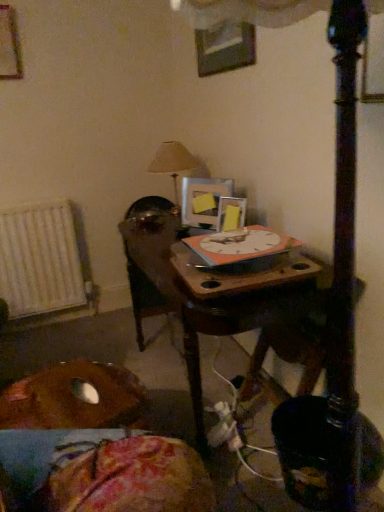
Question: Based on their sizes in the image, would you say matte silver picture frame at center, arranged as the fourth picture frame when viewed from the left, is bigger or smaller than yellow matte picture frame at upper center, which appears as the third picture frame when viewed from the top?

Choices:
 (A) small
 (B) big

Answer: (A)

Question: From the image's perspective, relative to yellow matte picture frame at upper center, which appears as the third picture frame when viewed from the top, is matte silver picture frame at center, arranged as the fourth picture frame when viewed from the left, above or below?

Choices:
 (A) above
 (B) below

Answer: (B)

Question: Which of these objects is positioned farthest from the metallic silver picture frame at upper center, the second picture frame viewed from the right?

Choices:
 (A) white metallic radiator at left
 (B) beige fabric lampshade at upper center
 (C) wooden picture frame at upper left, acting as the first picture frame starting from the left
 (D) yellow matte picture frame at upper center, marked as the second picture frame in a bottom-to-top arrangement
 (E) matte silver picture frame at center, the 4th picture frame in the top-to-bottom sequence

Answer: (A)

Question: Which of these objects is positioned farthest from the metallic silver picture frame at upper center, which is counted as the third picture frame, starting from the bottom?

Choices:
 (A) wooden picture frame at upper left, marked as the 4th picture frame in a bottom-to-top arrangement
 (B) brown fabric cushion at lower left
 (C) yellow matte picture frame at upper center, marked as the second picture frame in a bottom-to-top arrangement
 (D) matte silver picture frame at center, the 1th picture frame viewed from the right
 (E) beige fabric lampshade at upper center

Answer: (B)